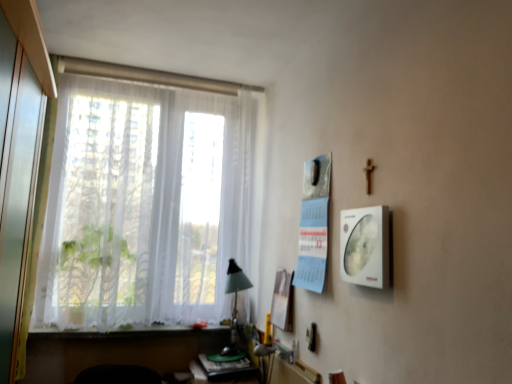
Question: Is white paper at center, acting as the second poster page starting from the front, thinner than white matte window sill at lower left?

Choices:
 (A) no
 (B) yes

Answer: (B)

Question: From a real-world perspective, is white paper at center, the 2th poster page from the top, below white matte window sill at lower left?

Choices:
 (A) no
 (B) yes

Answer: (A)

Question: Is white paper at center, positioned as the first poster page in back-to-front order, placed right next to white matte window sill at lower left?

Choices:
 (A) yes
 (B) no

Answer: (B)

Question: Considering the relative sizes of white paper at center, acting as the second poster page starting from the front, and white matte window sill at lower left in the image provided, is white paper at center, acting as the second poster page starting from the front, bigger than white matte window sill at lower left?

Choices:
 (A) yes
 (B) no

Answer: (B)

Question: Considering the relative sizes of white paper at center, positioned as the first poster page in back-to-front order, and white matte window sill at lower left in the image provided, is white paper at center, positioned as the first poster page in back-to-front order, wider than white matte window sill at lower left?

Choices:
 (A) no
 (B) yes

Answer: (A)

Question: Is white glossy picture frame at right inside the boundaries of white paper at center, which is counted as the 1th poster page, starting from the left, or outside?

Choices:
 (A) inside
 (B) outside

Answer: (B)

Question: Does point (360, 249) appear closer or farther from the camera than point (281, 281)?

Choices:
 (A) farther
 (B) closer

Answer: (B)

Question: From the image's perspective, is white glossy picture frame at right positioned above or below white paper at center, the 2th poster page from the top?

Choices:
 (A) below
 (B) above

Answer: (B)

Question: Is white glossy picture frame at right in front of or behind white paper at center, marked as the 1th poster page in a bottom-to-top arrangement, in the image?

Choices:
 (A) front
 (B) behind

Answer: (A)

Question: Is wooden table at lower center in front of or behind white sheer curtains at left in the image?

Choices:
 (A) front
 (B) behind

Answer: (B)

Question: Based on their sizes in the image, would you say wooden table at lower center is bigger or smaller than white sheer curtains at left?

Choices:
 (A) small
 (B) big

Answer: (A)

Question: From a real-world perspective, is wooden table at lower center above or below white sheer curtains at left?

Choices:
 (A) below
 (B) above

Answer: (A)

Question: Is wooden table at lower center taller or shorter than white sheer curtains at left?

Choices:
 (A) tall
 (B) short

Answer: (B)

Question: Does point (347, 264) appear closer or farther from the camera than point (222, 274)?

Choices:
 (A) closer
 (B) farther

Answer: (A)

Question: Is white glossy picture frame at right spatially inside white sheer curtains at left, or outside of it?

Choices:
 (A) outside
 (B) inside

Answer: (A)